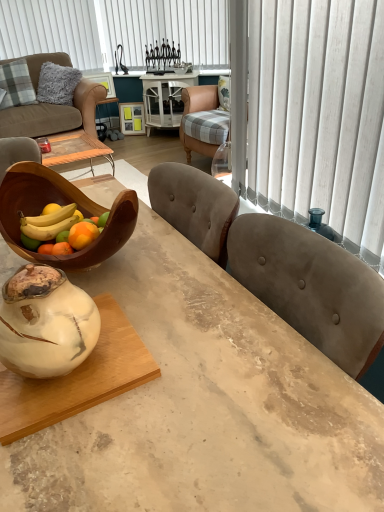
Question: From a real-world perspective, is white vertical blinds at upper center below marble table at center?

Choices:
 (A) no
 (B) yes

Answer: (A)

Question: Is marble table at center a part of white vertical blinds at upper center?

Choices:
 (A) yes
 (B) no

Answer: (B)

Question: Considering the relative sizes of white vertical blinds at upper center and marble table at center in the image provided, is white vertical blinds at upper center smaller than marble table at center?

Choices:
 (A) no
 (B) yes

Answer: (B)

Question: Is white vertical blinds at upper center shorter than marble table at center?

Choices:
 (A) yes
 (B) no

Answer: (B)

Question: Could you tell me if white vertical blinds at upper center is turned towards marble table at center?

Choices:
 (A) no
 (B) yes

Answer: (B)

Question: Does white vertical blinds at upper center lie behind marble table at center?

Choices:
 (A) yes
 (B) no

Answer: (A)

Question: Is white marble round table at center closer to camera compared to white marble coffee table at lower left?

Choices:
 (A) no
 (B) yes

Answer: (A)

Question: From a real-world perspective, is white marble round table at center on white marble coffee table at lower left?

Choices:
 (A) no
 (B) yes

Answer: (A)

Question: Considering the relative positions of white marble round table at center and white marble coffee table at lower left in the image provided, is white marble round table at center to the right of white marble coffee table at lower left from the viewer's perspective?

Choices:
 (A) no
 (B) yes

Answer: (B)

Question: Is white marble round table at center placed right next to white marble coffee table at lower left?

Choices:
 (A) yes
 (B) no

Answer: (B)

Question: Is white marble round table at center facing towards white marble coffee table at lower left?

Choices:
 (A) no
 (B) yes

Answer: (B)

Question: Can you confirm if white marble round table at center is positioned to the left of white marble coffee table at lower left?

Choices:
 (A) no
 (B) yes

Answer: (A)

Question: Is wooden bowl at left wider than white vertical blinds at upper center?

Choices:
 (A) yes
 (B) no

Answer: (A)